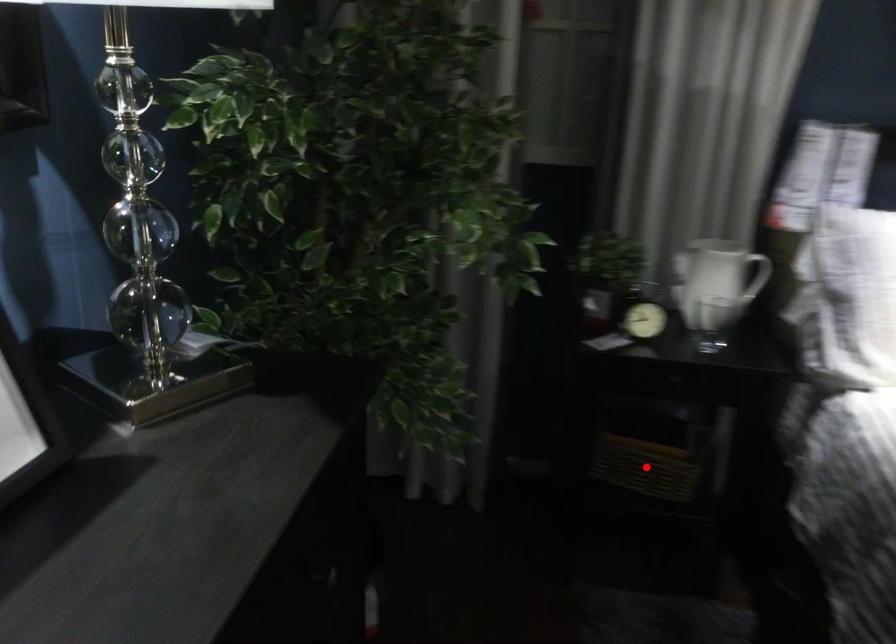
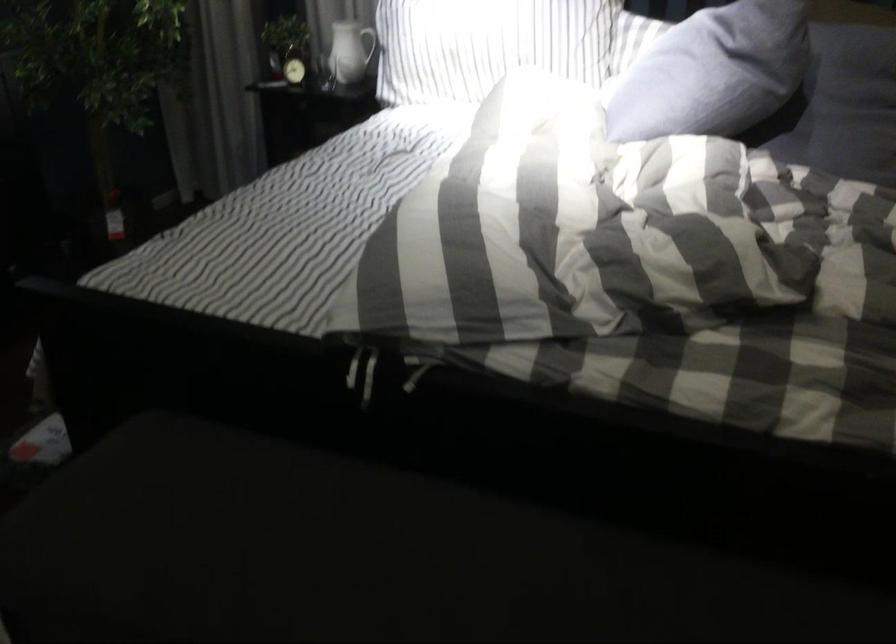
Question: I am providing you with two images of the same scene from different viewpoints. A red point is marked on the first image. At the location where the point appears in image 1, is it still visible in image 2?

Choices:
 (A) Yes
 (B) No

Answer: (B)